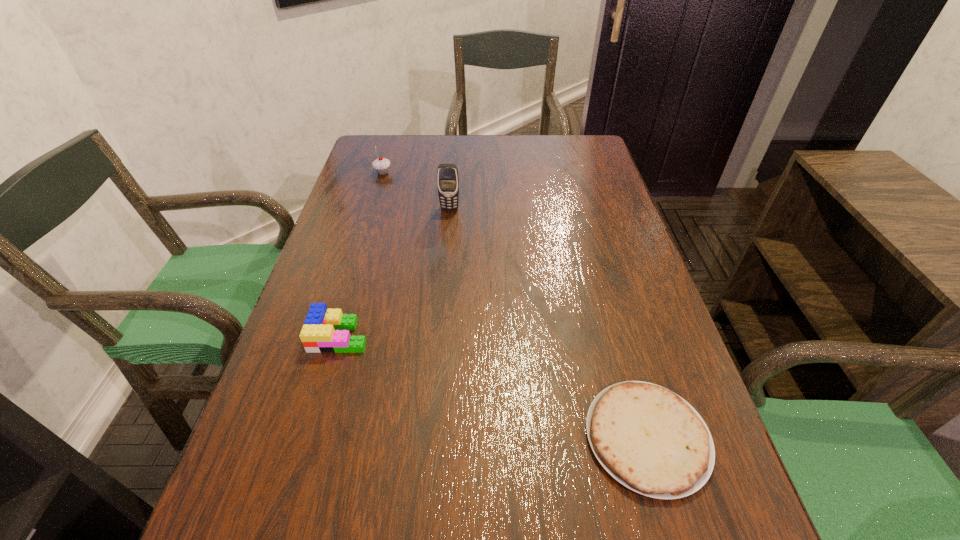
Locate an element on the screen. The height and width of the screenshot is (540, 960). the third object from left to right is located at coordinates (447, 174).

Where is `cellular telephone`? Image resolution: width=960 pixels, height=540 pixels. cellular telephone is located at coordinates (447, 174).

Image resolution: width=960 pixels, height=540 pixels. In order to click on cupcake in this screenshot , I will do [x=381, y=165].

The width and height of the screenshot is (960, 540). I want to click on the second tallest object, so click(381, 165).

Locate an element on the screen. the second nearest object is located at coordinates coord(325,330).

Where is `the second shortest object`? This screenshot has width=960, height=540. the second shortest object is located at coordinates (325, 330).

Identify the location of the shortest object. (648, 438).

Locate an element on the screen. the nearest object is located at coordinates (648, 438).

This screenshot has width=960, height=540. What are the coordinates of `vacant space located 0.400m on the front face of the third nearest object` in the screenshot? It's located at (440, 326).

The image size is (960, 540). In order to click on free space located on the back of the third shortest object in this screenshot , I will do `click(387, 158)`.